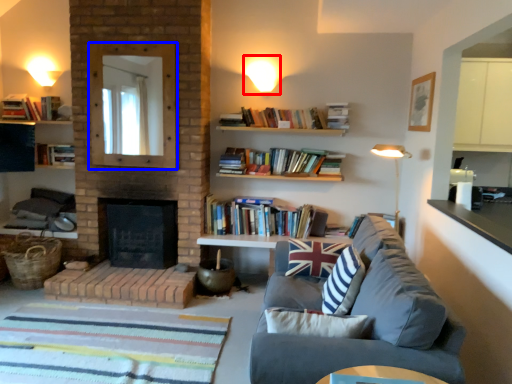
Question: Which of the following is the closest to the observer, lighting (highlighted by a red box) or mirror (highlighted by a blue box)?

Choices:
 (A) lighting
 (B) mirror

Answer: (B)